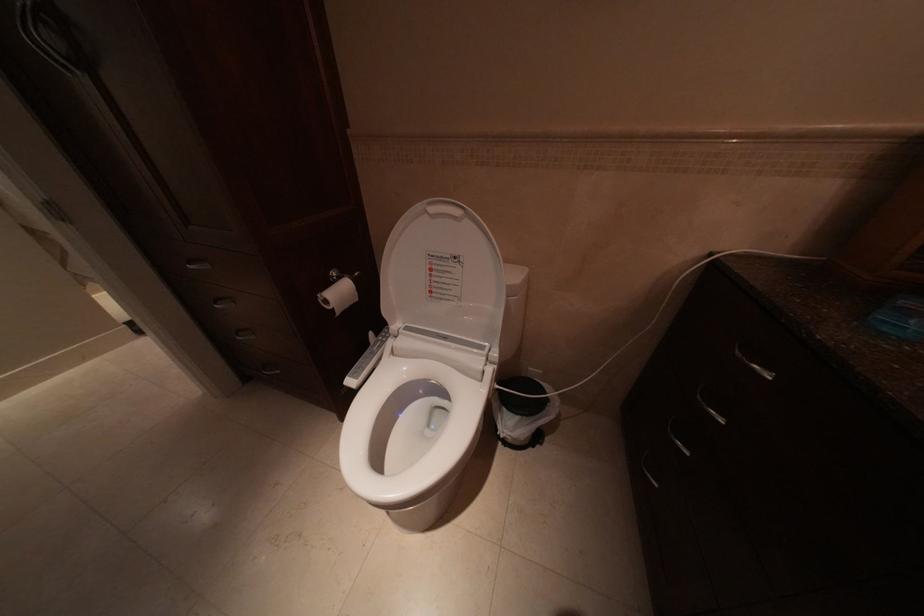
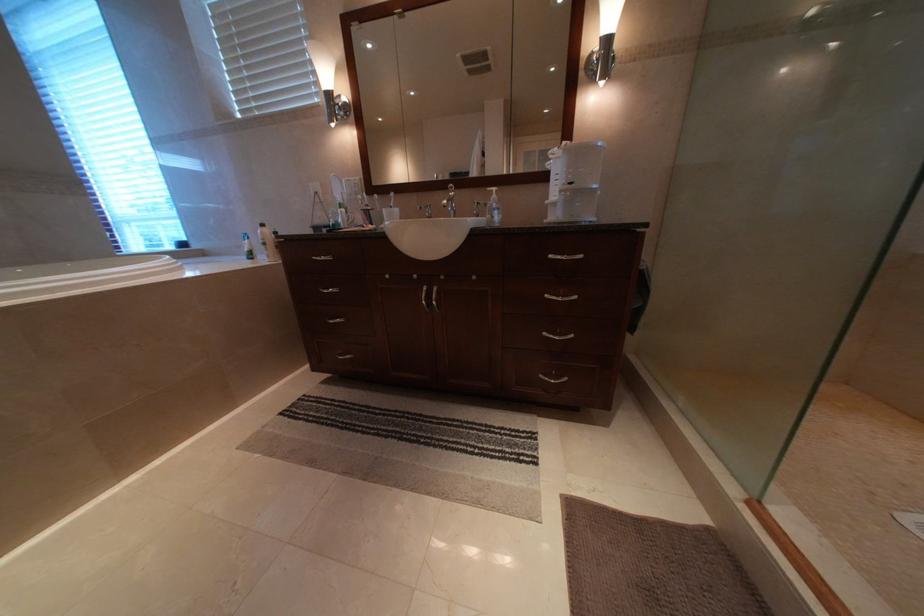
The images are taken continuously from a first-person perspective. In which direction are you moving?

The cameraman walked toward left, forward.